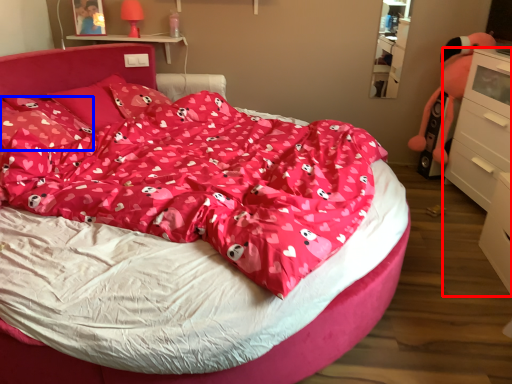
Question: Which object is further to the camera taking this photo, chest of drawers (highlighted by a red box) or pillow (highlighted by a blue box)?

Choices:
 (A) chest of drawers
 (B) pillow

Answer: (A)